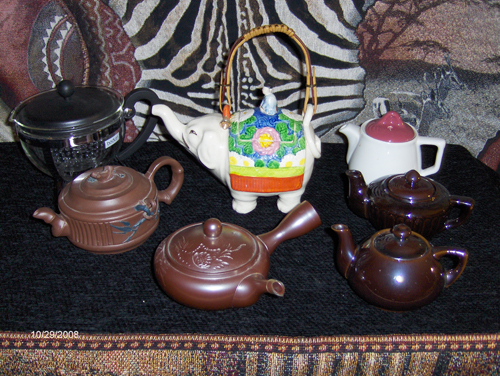
Identify the location of corner. The image size is (500, 376). (460, 144).